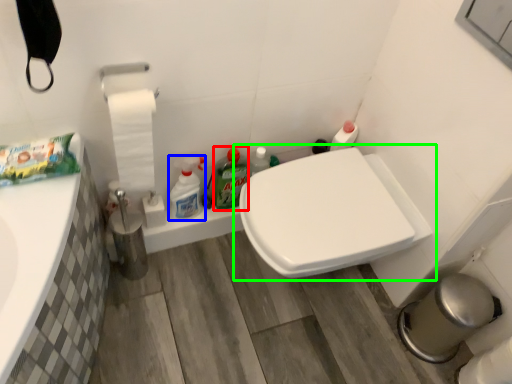
Question: Based on their relative distances, which object is farther from cleaning product (highlighted by a red box)? Choose from cleaning product (highlighted by a blue box) and toilet (highlighted by a green box).

Choices:
 (A) cleaning product
 (B) toilet

Answer: (B)